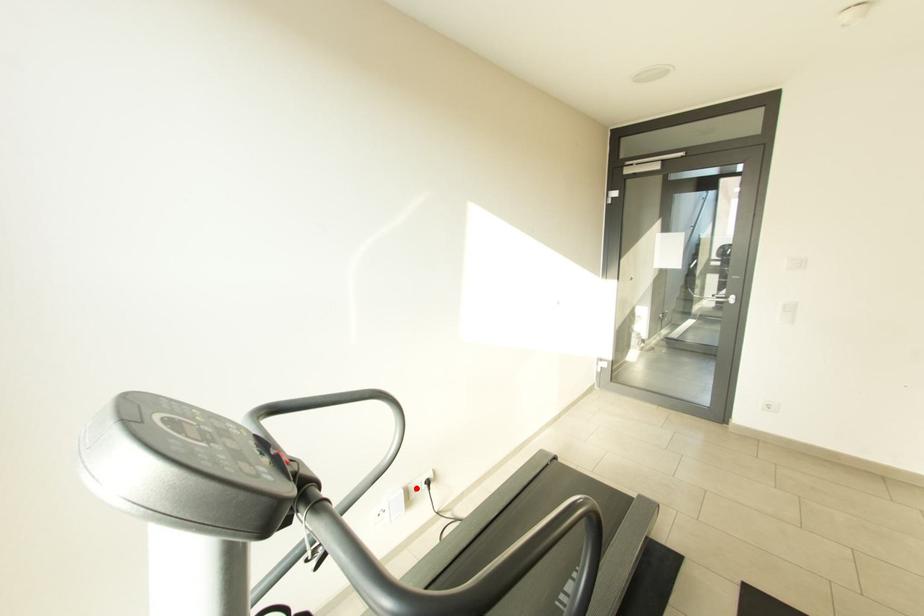
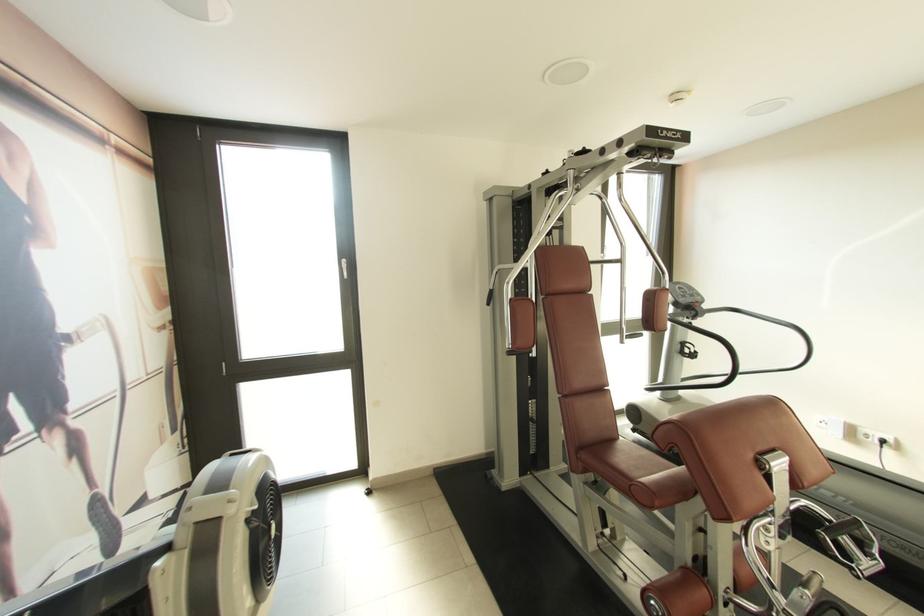
Where in the second image is the point corresponding to the highlighted location from the first image?

(868, 432)